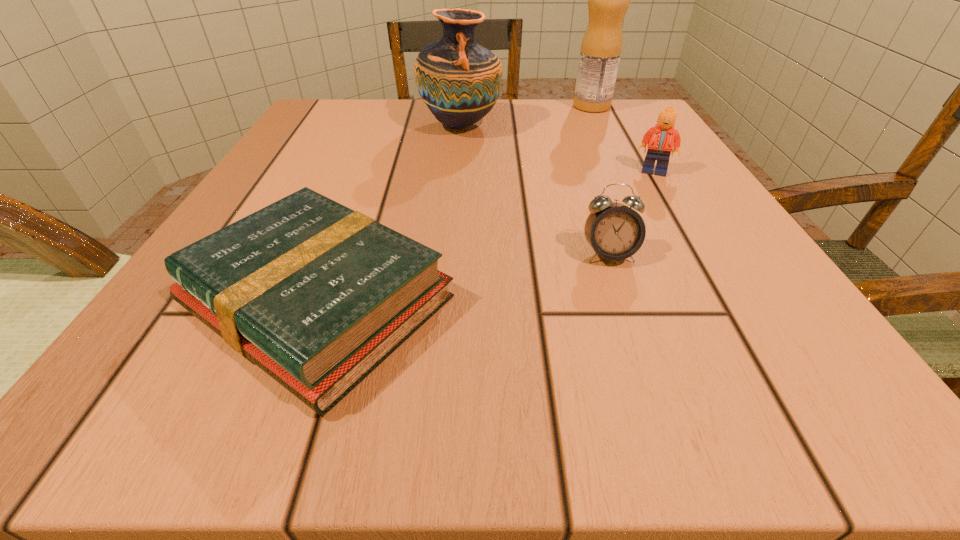
The image size is (960, 540). I want to click on vacant space that satisfies the following two spatial constraints: 1. on the front label of the tallest object; 2. on the front side of the fourth shortest object, so click(x=601, y=125).